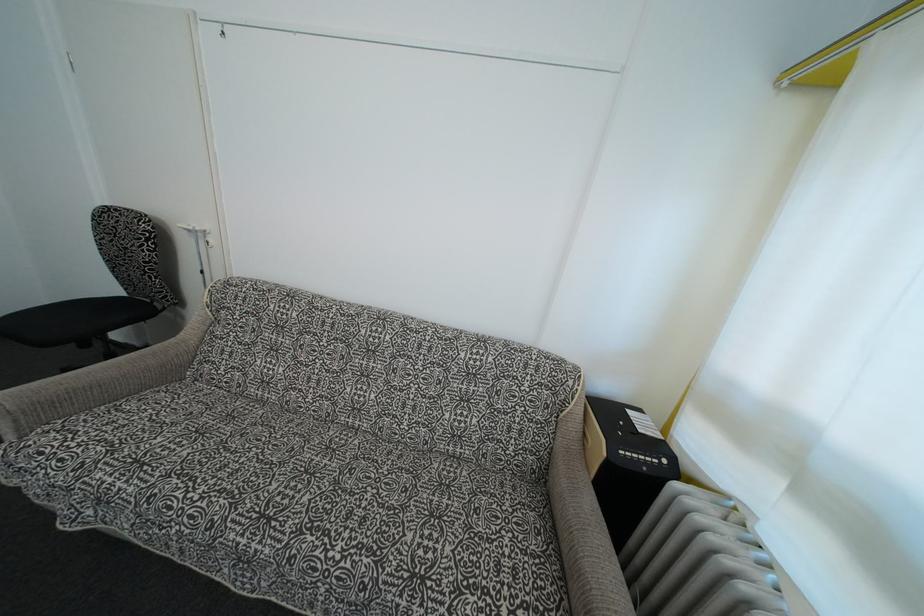
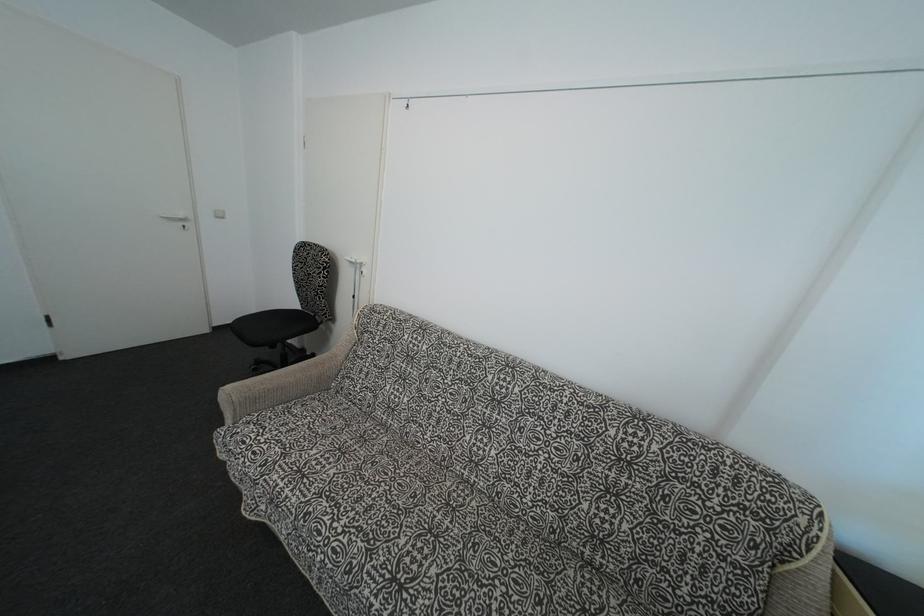
Question: Which direction would the cameraman need to move to produce the second image? Reply with the corresponding letter.

Choices:
 (A) Left
 (B) Right
 (C) Forward
 (D) Backward

Answer: (A)